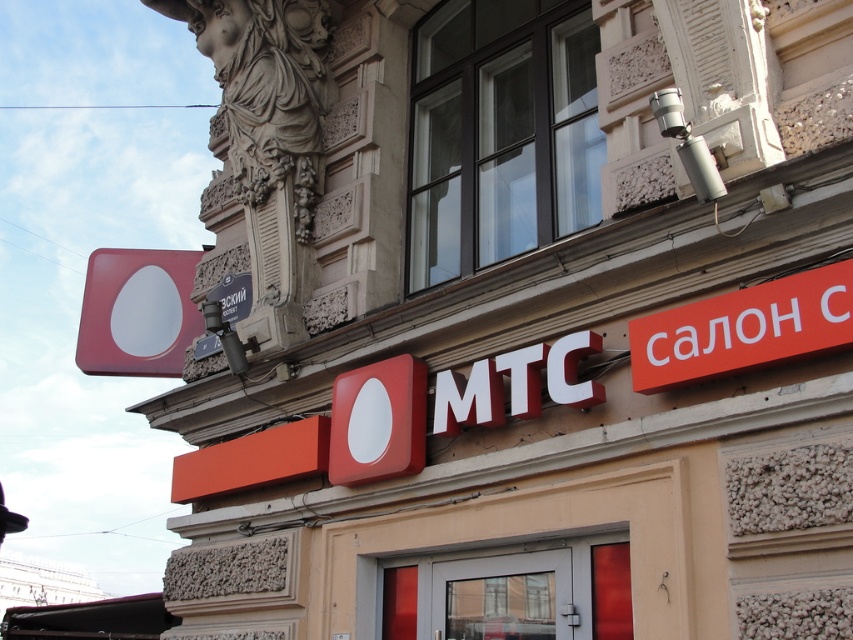
You are a customer standing in front of the building and want to locate both the orange matte sign at upper right and the matte red sign at upper left. According to the scene, which sign is positioned to the right side of the other?

The orange matte sign at upper right is to the right of the matte red sign at upper left.

You are a delivery person trying to locate the MTC salon entrance. You see the matte red sign at upper left and the metallic gray sign at upper center. Which sign is located to the left of the other?

The matte red sign at upper left is positioned on the left side of metallic gray sign at upper center.